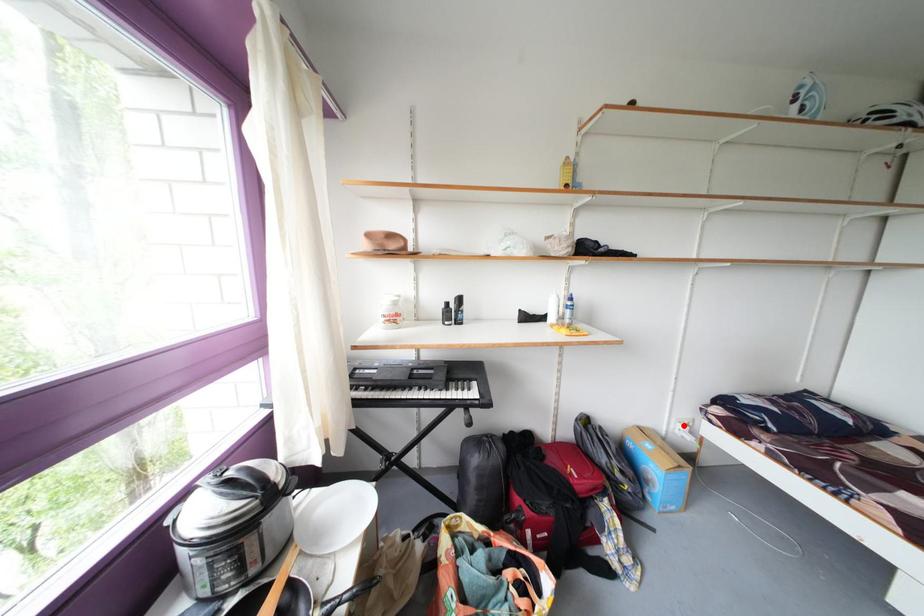
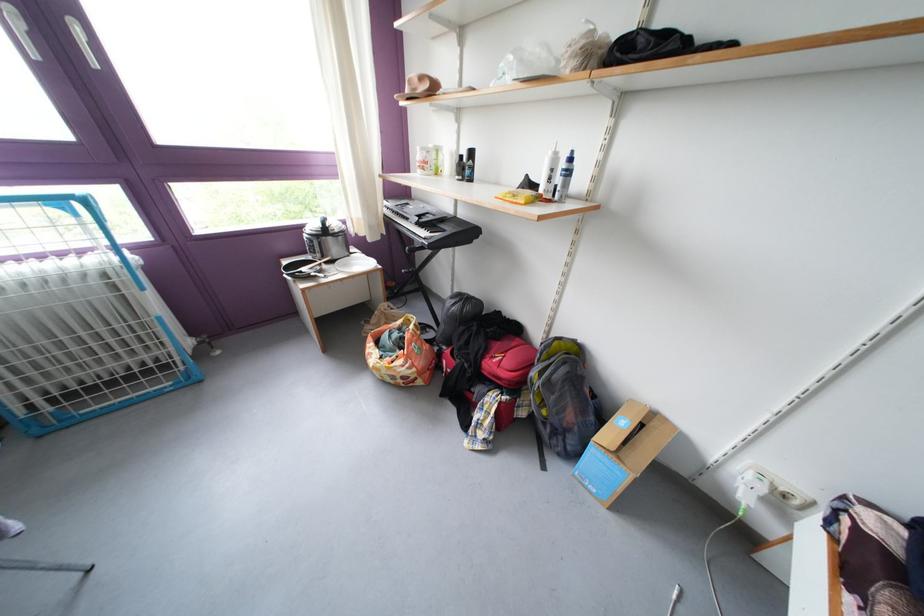
Locate, in the second image, the point that corresponds to the highlighted location in the first image.

(758, 467)